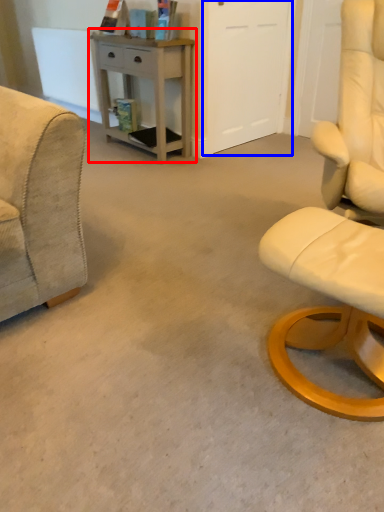
Question: Which object is closer to the camera taking this photo, desk (highlighted by a red box) or glass door (highlighted by a blue box)?

Choices:
 (A) desk
 (B) glass door

Answer: (A)